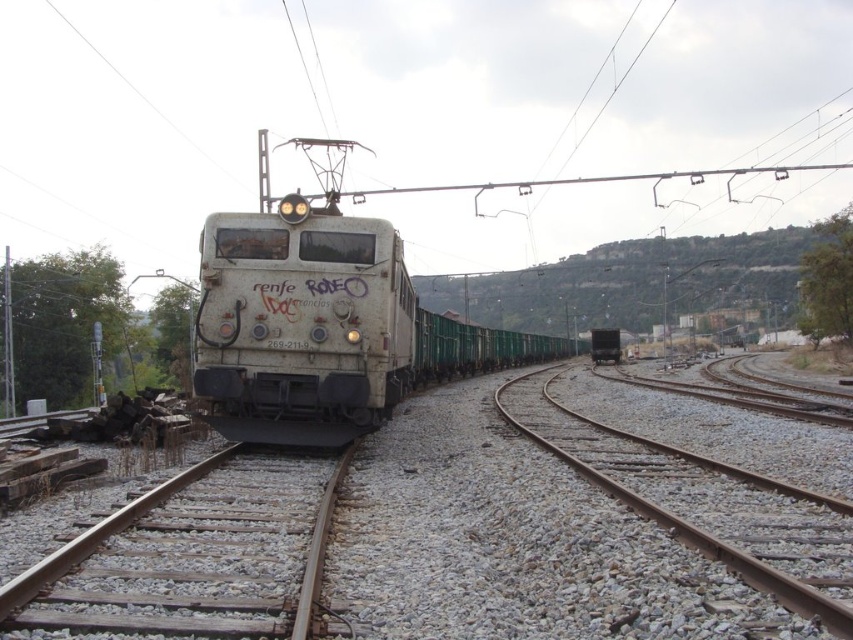
Question: Is white matte train at center positioned at the back of gray gravel train track at lower right?

Choices:
 (A) yes
 (B) no

Answer: (A)

Question: Observing the image, what is the correct spatial positioning of white matte train at center in reference to gray gravel train track at lower right?

Choices:
 (A) above
 (B) below

Answer: (A)

Question: Is white matte train at center smaller than gray gravel train track at lower right?

Choices:
 (A) yes
 (B) no

Answer: (B)